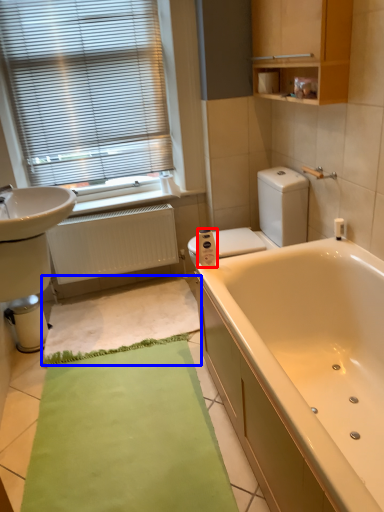
Question: Which of the following is the closest to the observer, toilet paper (highlighted by a red box) or bath mat (highlighted by a blue box)?

Choices:
 (A) toilet paper
 (B) bath mat

Answer: (A)